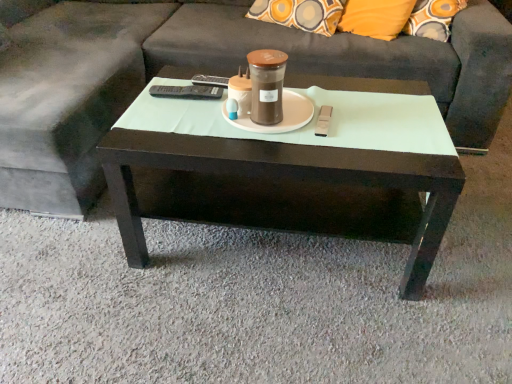
Where is `white matte saucer at center`? This screenshot has height=384, width=512. white matte saucer at center is located at coordinates (283, 115).

Where is `dark gray fabric couch at center`? This screenshot has height=384, width=512. dark gray fabric couch at center is located at coordinates (198, 65).

Describe the element at coordinates (267, 85) in the screenshot. I see `brown matte jar at center` at that location.

Image resolution: width=512 pixels, height=384 pixels. What are the coordinates of `white matte saucer at center` in the screenshot? It's located at (283, 115).

From a real-world perspective, is dark wood coffee table at center positioned over dark gray fabric couch at center based on gravity?

No, from a real-world perspective, dark wood coffee table at center is not on top of dark gray fabric couch at center.

Is point (204, 107) closer or farther from the camera than point (91, 177)?

Point (204, 107) is closer to the camera than point (91, 177).

Can you tell me how much dark wood coffee table at center and dark gray fabric couch at center differ in facing direction?

They differ by 1.49 degrees in their facing directions.

Is brown matte jar at center inside or outside of dark wood coffee table at center?

brown matte jar at center is outside dark wood coffee table at center.

Considering the sizes of objects brown matte jar at center and dark wood coffee table at center in the image provided, who is wider, brown matte jar at center or dark wood coffee table at center?

dark wood coffee table at center is wider.

Considering the points (267, 106) and (302, 149), which point is behind, point (267, 106) or point (302, 149)?

The point (267, 106) is farther.

Is brown matte jar at center positioned behind white matte saucer at center?

No, brown matte jar at center is closer to the viewer.

Which point is more forward, (259, 100) or (246, 119)?

Point (259, 100)

Visually, is brown matte jar at center positioned to the left or to the right of white matte saucer at center?

In the image, brown matte jar at center appears on the left side of white matte saucer at center.

Consider the image. Does brown matte jar at center turn towards white matte saucer at center?

No, brown matte jar at center is not aimed at white matte saucer at center.

Is dark wood coffee table at center facing towards white matte saucer at center?

No, dark wood coffee table at center does not turn towards white matte saucer at center.

Between dark wood coffee table at center and white matte saucer at center, which one appears on the left side from the viewer's perspective?

white matte saucer at center is more to the left.

From the image's perspective, would you say dark wood coffee table at center is positioned over white matte saucer at center?

No, from the image's perspective, dark wood coffee table at center is not above white matte saucer at center.

Is dark wood coffee table at center beside white matte saucer at center?

There is a gap between dark wood coffee table at center and white matte saucer at center.

From the image's perspective, would you say brown matte jar at center is shown under dark gray fabric couch at center?

Yes, from the image's perspective, brown matte jar at center is beneath dark gray fabric couch at center.

Where is `beverage behind the dark gray fabric couch at center`? beverage behind the dark gray fabric couch at center is located at coordinates (267, 85).

Considering the relative sizes of brown matte jar at center and dark gray fabric couch at center in the image provided, is brown matte jar at center bigger than dark gray fabric couch at center?

No.

From a real-world perspective, relative to dark gray fabric couch at center, is brown matte jar at center vertically above or below?

From a real-world perspective, brown matte jar at center is physically above dark gray fabric couch at center.

Which of these two, dark gray fabric couch at center or brown matte jar at center, is bigger?

With larger size is dark gray fabric couch at center.

Considering the sizes of dark gray fabric couch at center and brown matte jar at center in the image, is dark gray fabric couch at center wider or thinner than brown matte jar at center?

Clearly, dark gray fabric couch at center has more width compared to brown matte jar at center.

You are a GUI agent. You are given a task and a screenshot of the screen. Output one action in this format:
    pyautogui.click(x=<x>, y=<y>)
    Task: Click on the studio couch directly beneath the brown matte jar at center (from a real-world perspective)
    Image resolution: width=512 pixels, height=384 pixels.
    Given the screenshot: What is the action you would take?
    pyautogui.click(x=198, y=65)

From the image's perspective, is dark gray fabric couch at center on brown matte jar at center?

Yes, from the image's perspective, dark gray fabric couch at center is over brown matte jar at center.

From the picture: Considering the relative positions of dark wood coffee table at center and brown matte jar at center in the image provided, is dark wood coffee table at center to the left of brown matte jar at center from the viewer's perspective?

No.

Does dark wood coffee table at center have a larger size compared to brown matte jar at center?

Correct, dark wood coffee table at center is larger in size than brown matte jar at center.

In terms of width, does dark wood coffee table at center look wider or thinner when compared to brown matte jar at center?

dark wood coffee table at center is wider than brown matte jar at center.

Consider the image. Are dark wood coffee table at center and brown matte jar at center beside each other?

No.

In the image, there is a dark gray fabric couch at center. Identify the location of coffee table below it (from the image's perspective). The width and height of the screenshot is (512, 384). (293, 170).

What are the coordinates of `coffee table below the brown matte jar at center (from a real-world perspective)` in the screenshot? It's located at (293, 170).

Looking at the image, which one is located further to white matte saucer at center, dark gray fabric couch at center or dark wood coffee table at center?

dark gray fabric couch at center lies further to white matte saucer at center than the other object.

When comparing their distances from brown matte jar at center, does white matte saucer at center or dark gray fabric couch at center seem closer?

white matte saucer at center lies closer to brown matte jar at center than the other object.

Based on their spatial positions, is dark gray fabric couch at center or white matte saucer at center further from dark wood coffee table at center?

dark gray fabric couch at center lies further to dark wood coffee table at center than the other object.

Considering their positions, is brown matte jar at center positioned further to dark gray fabric couch at center than dark wood coffee table at center?

brown matte jar at center.

When comparing their distances from white matte saucer at center, does dark wood coffee table at center or dark gray fabric couch at center seem further?

Based on the image, dark gray fabric couch at center appears to be further to white matte saucer at center.

From the image, which object appears to be farther from dark gray fabric couch at center, dark wood coffee table at center or white matte saucer at center?

The object further to dark gray fabric couch at center is white matte saucer at center.

Looking at the image, which one is located further to dark wood coffee table at center, brown matte jar at center or white matte saucer at center?

brown matte jar at center.

When comparing their distances from white matte saucer at center, does brown matte jar at center or dark gray fabric couch at center seem closer?

brown matte jar at center.

This screenshot has height=384, width=512. Identify the location of saucer that lies between brown matte jar at center and dark wood coffee table at center from top to bottom. (283, 115).

Find the location of a particular element. beverage between dark gray fabric couch at center and white matte saucer at center in the vertical direction is located at coordinates (267, 85).

Where is `saucer between dark gray fabric couch at center and dark wood coffee table at center from top to bottom`? The height and width of the screenshot is (384, 512). saucer between dark gray fabric couch at center and dark wood coffee table at center from top to bottom is located at coordinates (283, 115).

This screenshot has height=384, width=512. Find the location of `beverage between dark gray fabric couch at center and dark wood coffee table at center in the up-down direction`. beverage between dark gray fabric couch at center and dark wood coffee table at center in the up-down direction is located at coordinates tap(267, 85).